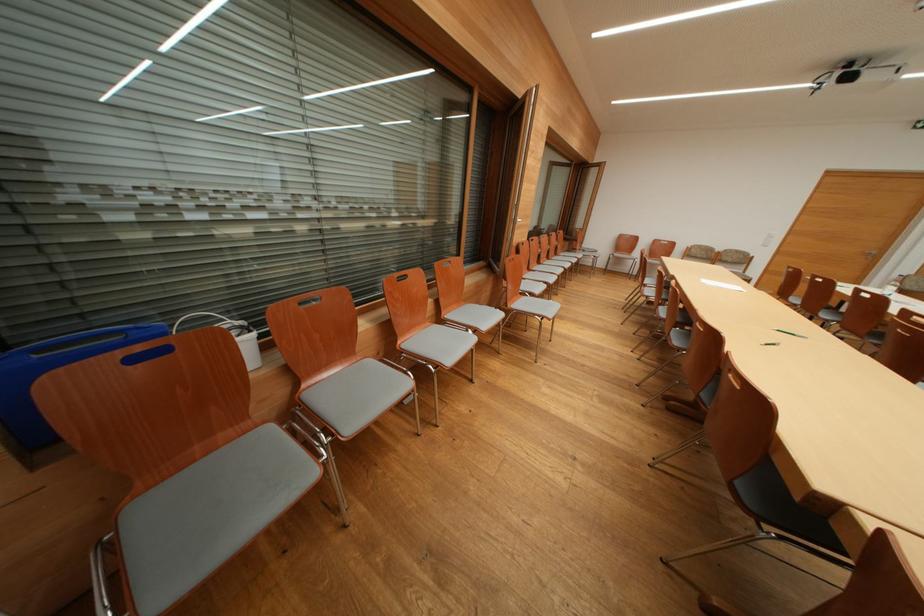
Which object does [722,285] point to?

It corresponds to the white paper sheet in the image.